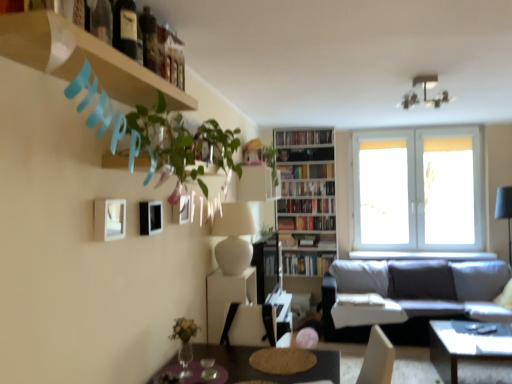
Question: Is green glass wine bottle at upper left, acting as the third wine bottle starting from the back, not within green leafy plant at upper center, marked as the 2th plant in a back-to-front arrangement?

Choices:
 (A) no
 (B) yes

Answer: (B)

Question: Can you confirm if green glass wine bottle at upper left, the first wine bottle when ordered from front to back, is bigger than green leafy plant at upper center, which is counted as the second plant, starting from the left?

Choices:
 (A) yes
 (B) no

Answer: (B)

Question: From the image's perspective, would you say green glass wine bottle at upper left, acting as the third wine bottle starting from the back, is shown under green leafy plant at upper center, arranged as the second plant when viewed from the right?

Choices:
 (A) no
 (B) yes

Answer: (A)

Question: Is green leafy plant at upper center, arranged as the 2th plant when viewed from the front, at the back of green glass wine bottle at upper left, acting as the third wine bottle starting from the back?

Choices:
 (A) yes
 (B) no

Answer: (B)

Question: Is green glass wine bottle at upper left, the first wine bottle when ordered from front to back, at the right side of green leafy plant at upper center, which is counted as the second plant, starting from the left?

Choices:
 (A) no
 (B) yes

Answer: (A)

Question: Can you confirm if green glass wine bottle at upper left, acting as the third wine bottle starting from the back, is thinner than green leafy plant at upper center, arranged as the 2th plant when viewed from the front?

Choices:
 (A) yes
 (B) no

Answer: (A)

Question: From the image's perspective, would you say hardcover book at center, arranged as the first book when ordered from the bottom, is positioned over green leafy plant at upper center, which ranks as the first plant in back-to-front order?

Choices:
 (A) yes
 (B) no

Answer: (B)

Question: From a real-world perspective, is hardcover book at center, arranged as the first book when ordered from the bottom, under green leafy plant at upper center, the first plant positioned from the right?

Choices:
 (A) yes
 (B) no

Answer: (A)

Question: Does hardcover book at center, which is the 6th book in top-to-bottom order, appear on the right side of green leafy plant at upper center, the 3th plant from the left?

Choices:
 (A) no
 (B) yes

Answer: (B)

Question: Can you confirm if hardcover book at center, which is the 6th book in top-to-bottom order, is positioned to the left of green leafy plant at upper center, marked as the third plant in a front-to-back arrangement?

Choices:
 (A) yes
 (B) no

Answer: (B)

Question: Does hardcover book at center, which is the 6th book in top-to-bottom order, have a larger size compared to green leafy plant at upper center, the first plant positioned from the right?

Choices:
 (A) yes
 (B) no

Answer: (A)

Question: Is hardcover book at center, arranged as the first book when ordered from the bottom, positioned beyond the bounds of green leafy plant at upper center, the first plant positioned from the right?

Choices:
 (A) no
 (B) yes

Answer: (B)

Question: Is hardcover books at upper center, which is the sixth book in bottom-to-top order, at the right side of green leafy plant at upper left, which is the third plant from right to left?

Choices:
 (A) yes
 (B) no

Answer: (A)